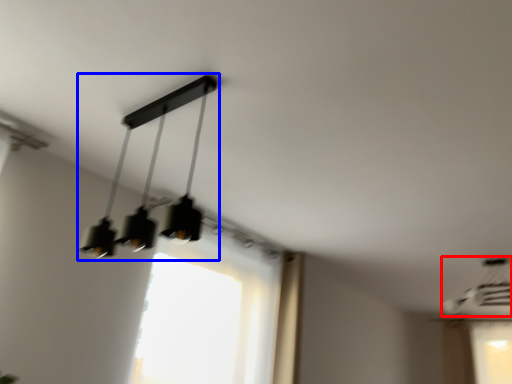
Question: Which object is closer to the camera taking this photo, lamp (highlighted by a red box) or lamp (highlighted by a blue box)?

Choices:
 (A) lamp
 (B) lamp

Answer: (B)